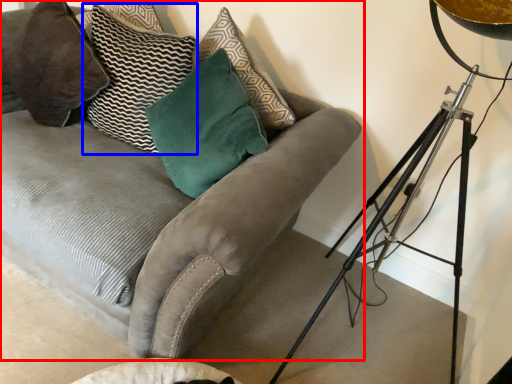
Question: Which object is further to the camera taking this photo, studio couch (highlighted by a red box) or pillow (highlighted by a blue box)?

Choices:
 (A) studio couch
 (B) pillow

Answer: (B)